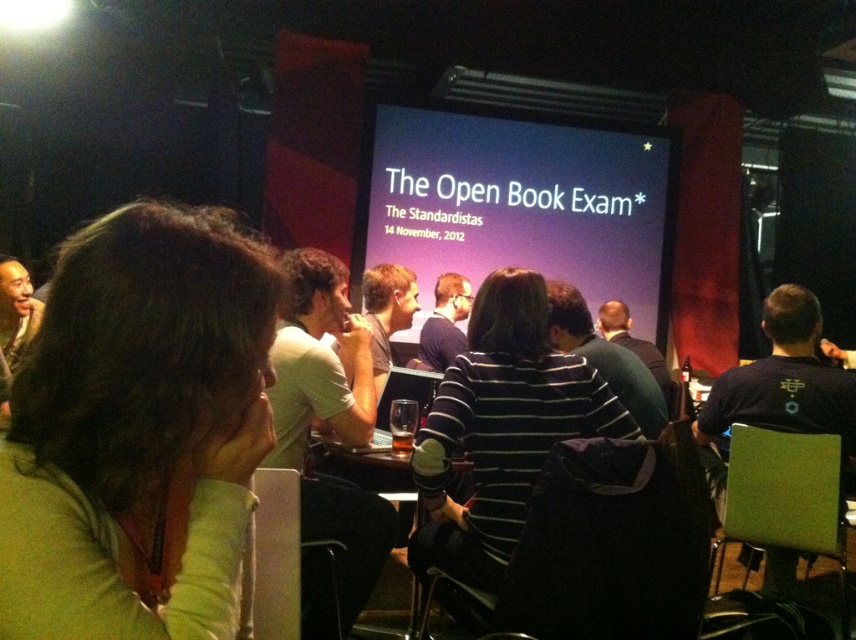
Question: Which object is the closest to the green fabric shirt at lower left?

Choices:
 (A) purple matte screen at center
 (B) purple matte shirt at center

Answer: (B)

Question: Which of the following is the closest to the observer?

Choices:
 (A) (278, 348)
 (B) (146, 472)
 (C) (506, 144)
 (D) (432, 344)

Answer: (B)

Question: Can you confirm if purple matte screen at center is smaller than white shirt at center?

Choices:
 (A) no
 (B) yes

Answer: (A)

Question: Is purple matte screen at center to the left of purple matte shirt at center from the viewer's perspective?

Choices:
 (A) yes
 (B) no

Answer: (B)

Question: Which point is closer to the camera?

Choices:
 (A) green fabric shirt at lower left
 (B) purple matte screen at center
 (C) purple matte shirt at center

Answer: (A)

Question: Is purple matte screen at center positioned in front of purple matte shirt at center?

Choices:
 (A) yes
 (B) no

Answer: (B)